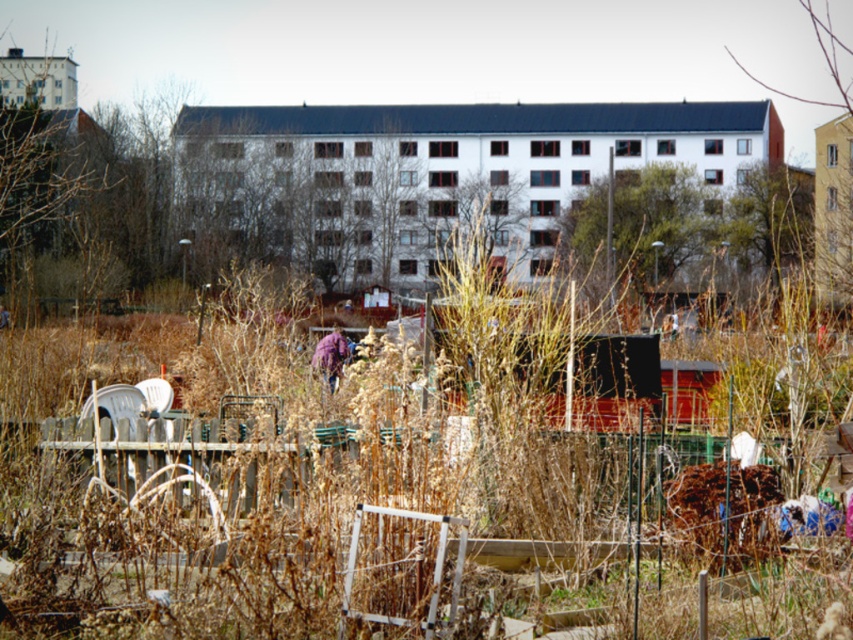
At what (x,y) coordinates should I click in order to perform the action: click on white plastic chair at center. Please return your answer as a coordinate pair (x, y). This screenshot has width=853, height=640. Looking at the image, I should click on (433, 568).

Locate an element on the screen. The width and height of the screenshot is (853, 640). white plastic chair at center is located at coordinates (433, 568).

Where is `white plastic chair at center`? white plastic chair at center is located at coordinates (433, 568).